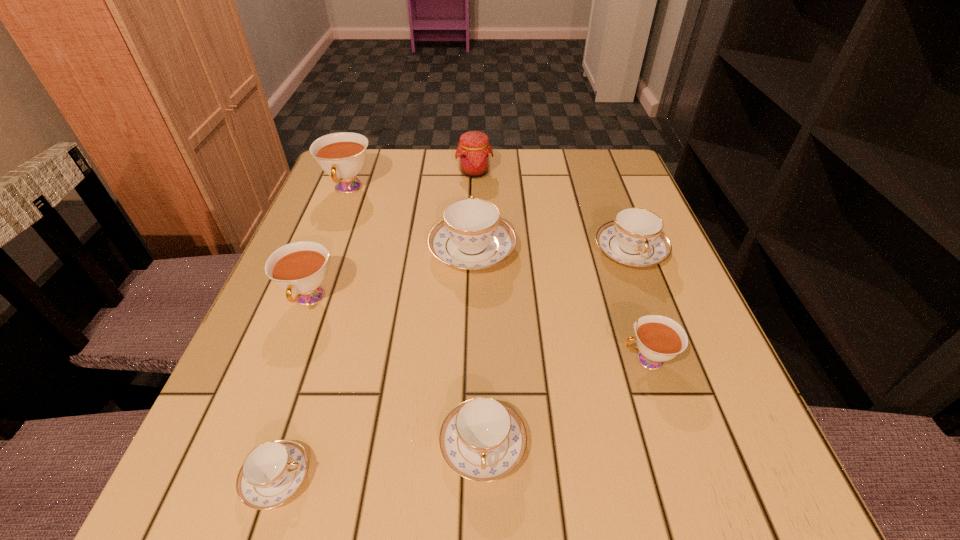
At what (x,y) coordinates should I click in order to perform the action: click on free region located 0.260m on the side of the third nearest object with the handle. Please return your answer as a coordinate pair (x, y). Image resolution: width=960 pixels, height=540 pixels. Looking at the image, I should click on (459, 360).

The height and width of the screenshot is (540, 960). I want to click on vacant space situated 0.140m on the side with the handle of the smallest blue teacup, so click(417, 478).

Where is `teacup located in the far edge section of the desktop`? This screenshot has height=540, width=960. teacup located in the far edge section of the desktop is located at coordinates (342, 155).

The image size is (960, 540). Identify the location of jam at the far edge. (474, 152).

This screenshot has height=540, width=960. I want to click on object at the far left corner, so click(x=342, y=155).

The height and width of the screenshot is (540, 960). I want to click on object that is at the near left corner, so click(x=273, y=472).

In the image, there is a desktop. Where is `blank space at the far edge`? This screenshot has height=540, width=960. blank space at the far edge is located at coordinates (405, 166).

Image resolution: width=960 pixels, height=540 pixels. In order to click on vacant area at the near edge of the desktop in this screenshot , I will do `click(337, 491)`.

Find the location of `vacant area at the left edge`. vacant area at the left edge is located at coordinates (323, 206).

You are a GUI agent. You are given a task and a screenshot of the screen. Output one action in this format:
    pyautogui.click(x=<x>, y=<y>)
    Task: Click on the blank space at the right edge of the desktop
    This screenshot has height=540, width=960.
    Given the screenshot: What is the action you would take?
    pyautogui.click(x=642, y=299)